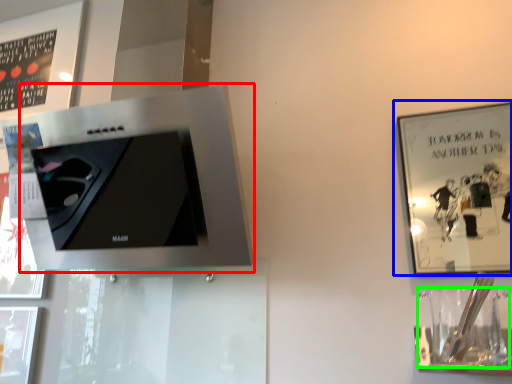
Question: Estimate the real-world distances between objects in this image. Which object is farther from appliance (highlighted by a red box), picture frame (highlighted by a blue box) or wine glass (highlighted by a green box)?

Choices:
 (A) picture frame
 (B) wine glass

Answer: (A)